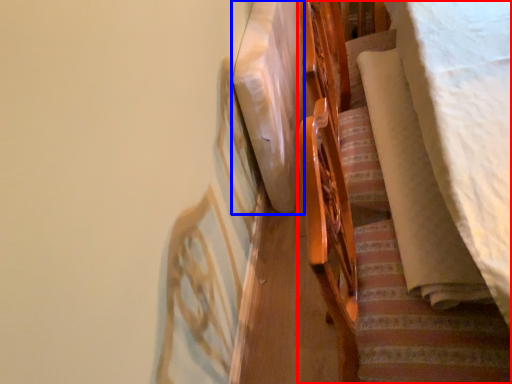
Question: Among these objects, which one is nearest to the camera, furniture (highlighted by a red box) or linen (highlighted by a blue box)?

Choices:
 (A) furniture
 (B) linen

Answer: (A)